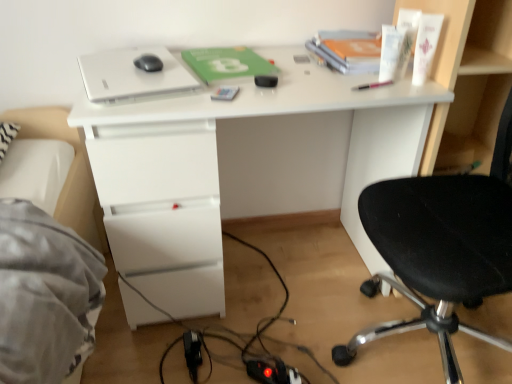
Image resolution: width=512 pixels, height=384 pixels. Identify the location of free point in front of pink plastic pen at upper right, positioned as the 1th stationery in right-to-left order. (376, 94).